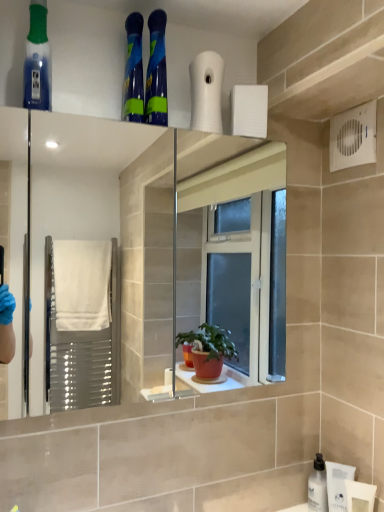
Question: From the image's perspective, would you say white plastic bottle at lower right is positioned over white matte bottle at lower right?

Choices:
 (A) no
 (B) yes

Answer: (B)

Question: From a real-world perspective, is white plastic bottle at lower right located beneath white matte bottle at lower right?

Choices:
 (A) no
 (B) yes

Answer: (A)

Question: Considering the relative positions of white plastic bottle at lower right and white matte bottle at lower right in the image provided, is white plastic bottle at lower right behind white matte bottle at lower right?

Choices:
 (A) yes
 (B) no

Answer: (B)

Question: Does white plastic bottle at lower right have a lesser height compared to white matte bottle at lower right?

Choices:
 (A) yes
 (B) no

Answer: (B)

Question: Is white plastic bottle at lower right not inside white matte bottle at lower right?

Choices:
 (A) no
 (B) yes

Answer: (B)

Question: Considering the relative sizes of white plastic bottle at lower right and white matte bottle at lower right in the image provided, is white plastic bottle at lower right thinner than white matte bottle at lower right?

Choices:
 (A) no
 (B) yes

Answer: (B)

Question: Can we say white plastic bottle at lower right lies outside translucent blue mouthwash at upper left?

Choices:
 (A) yes
 (B) no

Answer: (A)

Question: From the image's perspective, is white plastic bottle at lower right located beneath translucent blue mouthwash at upper left?

Choices:
 (A) yes
 (B) no

Answer: (A)

Question: Does white plastic bottle at lower right turn towards translucent blue mouthwash at upper left?

Choices:
 (A) yes
 (B) no

Answer: (B)

Question: Does white plastic bottle at lower right have a greater width compared to translucent blue mouthwash at upper left?

Choices:
 (A) yes
 (B) no

Answer: (B)

Question: From the image's perspective, does white plastic bottle at lower right appear higher than translucent blue mouthwash at upper left?

Choices:
 (A) yes
 (B) no

Answer: (B)

Question: Can you confirm if white plastic bottle at lower right is thinner than translucent blue mouthwash at upper left?

Choices:
 (A) yes
 (B) no

Answer: (A)

Question: Does white matte bottle at lower right have a smaller size compared to translucent blue mouthwash at upper left?

Choices:
 (A) no
 (B) yes

Answer: (B)